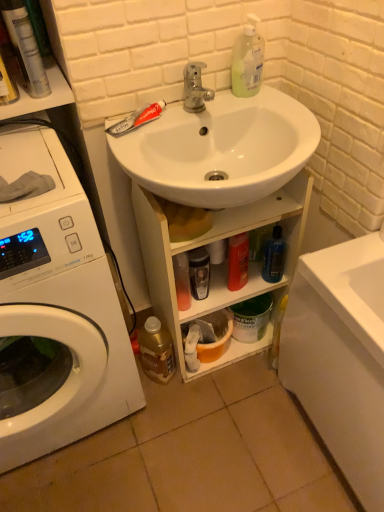
Question: Is gold metallic bottle at lower left, which ranks as the first bottle in left-to-right order, facing towards blue translucent bottle at lower center, the 2th bottle from the left?

Choices:
 (A) yes
 (B) no

Answer: (B)

Question: Considering the relative positions of gold metallic bottle at lower left, which appears as the second bottle when viewed from the right, and blue translucent bottle at lower center, the first bottle positioned from the right, in the image provided, is gold metallic bottle at lower left, which appears as the second bottle when viewed from the right, to the right of blue translucent bottle at lower center, the first bottle positioned from the right, from the viewer's perspective?

Choices:
 (A) no
 (B) yes

Answer: (A)

Question: From the image's perspective, is gold metallic bottle at lower left, which appears as the second bottle when viewed from the right, beneath blue translucent bottle at lower center, marked as the 2th bottle in a bottom-to-top arrangement?

Choices:
 (A) yes
 (B) no

Answer: (A)

Question: Is gold metallic bottle at lower left, which appears as the second bottle when viewed from the right, thinner than blue translucent bottle at lower center, which is the first bottle from top to bottom?

Choices:
 (A) yes
 (B) no

Answer: (B)

Question: Can you confirm if gold metallic bottle at lower left, the first bottle when ordered from bottom to top, is smaller than blue translucent bottle at lower center, the 2th bottle from the left?

Choices:
 (A) yes
 (B) no

Answer: (B)

Question: Is blue translucent bottle at lower center, the 2th bottle from the left, completely or partially inside gold metallic bottle at lower left, which appears as the second bottle when viewed from the right?

Choices:
 (A) yes
 (B) no

Answer: (B)

Question: Are blue translucent bottle at lower center, the 2th bottle from the left, and translucent plastic bottle at upper right located far from each other?

Choices:
 (A) no
 (B) yes

Answer: (A)

Question: Is blue translucent bottle at lower center, which is the first bottle from top to bottom, not within translucent plastic bottle at upper right?

Choices:
 (A) no
 (B) yes

Answer: (B)

Question: Considering the relative positions of blue translucent bottle at lower center, which is the first bottle from top to bottom, and translucent plastic bottle at upper right in the image provided, is blue translucent bottle at lower center, which is the first bottle from top to bottom, to the left of translucent plastic bottle at upper right from the viewer's perspective?

Choices:
 (A) yes
 (B) no

Answer: (B)

Question: Is blue translucent bottle at lower center, marked as the 2th bottle in a bottom-to-top arrangement, placed right next to translucent plastic bottle at upper right?

Choices:
 (A) no
 (B) yes

Answer: (A)

Question: From a real-world perspective, does blue translucent bottle at lower center, marked as the 2th bottle in a bottom-to-top arrangement, stand above translucent plastic bottle at upper right?

Choices:
 (A) yes
 (B) no

Answer: (B)

Question: From the image's perspective, does blue translucent bottle at lower center, the first bottle positioned from the right, appear lower than translucent plastic bottle at upper right?

Choices:
 (A) yes
 (B) no

Answer: (A)

Question: Can you confirm if white glossy washing machine at left is bigger than shiny black bottle at center, the 2th toiletry viewed from the left?

Choices:
 (A) no
 (B) yes

Answer: (B)